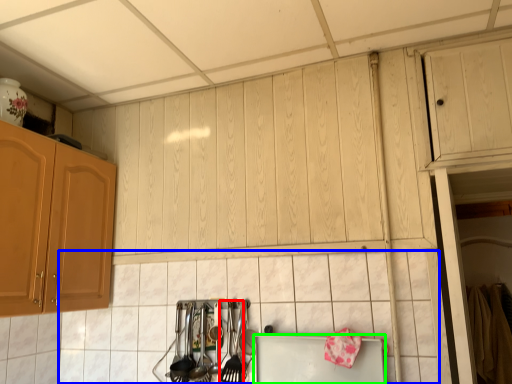
Question: Estimate the real-world distances between objects in this image. Which object is farther from silverware (highlighted by a red box), tile (highlighted by a blue box) or appliance (highlighted by a green box)?

Choices:
 (A) tile
 (B) appliance

Answer: (A)